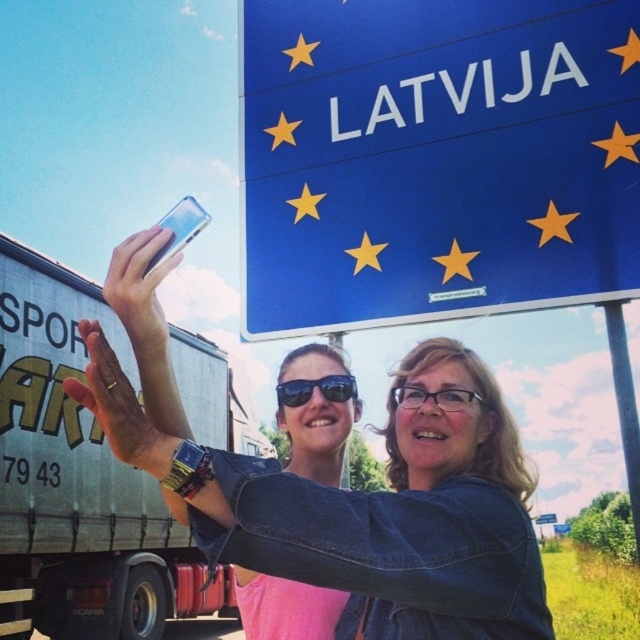
You are a photographer trying to capture the two people in the image while ensuring they are both in focus. Given that your camera has a depth of field that can cover a maximum distance of 2 meters between subjects, will you be able to take a clear photo of both individuals wearing the denim jacket at center?

The two people wearing denim jacket at center are 2.45 meters apart, which exceeds the camera depth of field maximum distance of 2 meters. Therefore, it will be difficult to capture both in focus simultaneously.

You are a photographer trying to capture the scene of two people taking a selfie at a border crossing. You notice the denim jacket at center and the clear glass phone at upper left. Which object is positioned lower in the image?

The denim jacket at center is positioned lower than the clear glass phone at upper left.

You are a photographer trying to capture the blue glossy sign at upper center and the metallic silver truck at left in a single frame. Based on their positions, which object should you adjust your camera angle to focus on first to ensure both are in the shot?

The blue glossy sign at upper center is positioned on the right side of metallic silver truck at left. To capture both in a single frame, you should first focus on the metallic silver truck at left since it is closer to the left edge, then adjust the camera angle to include the blue glossy sign at upper center on the right side.